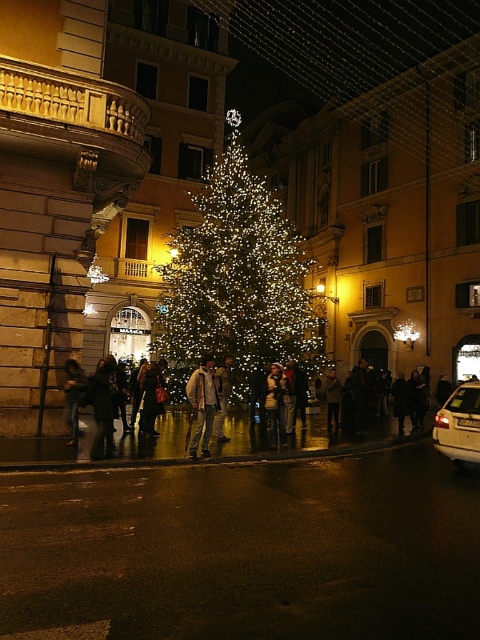
Question: Which point is farther from the camera taking this photo?

Choices:
 (A) (208, 416)
 (B) (204, 184)
 (C) (70, 394)
 (D) (273, 445)

Answer: (B)

Question: Is illuminated glass christmas tree at center to the left of leather jacket at center from the viewer's perspective?

Choices:
 (A) no
 (B) yes

Answer: (B)

Question: Can you confirm if shiny metallic crowd at center is smaller than metallic silver car at lower right?

Choices:
 (A) no
 (B) yes

Answer: (A)

Question: Can you confirm if metallic silver car at lower right is smaller than khaki cotton jacket at center?

Choices:
 (A) no
 (B) yes

Answer: (A)

Question: Which object is positioned farthest from the shiny metallic crowd at center?

Choices:
 (A) leather jacket at center
 (B) illuminated glass christmas tree at center
 (C) metallic silver car at lower right
 (D) khaki cotton jacket at center

Answer: (B)

Question: Among these points, which one is farthest from the camera?

Choices:
 (A) (199, 372)
 (B) (147, 454)
 (C) (477, 436)
 (D) (272, 419)

Answer: (D)